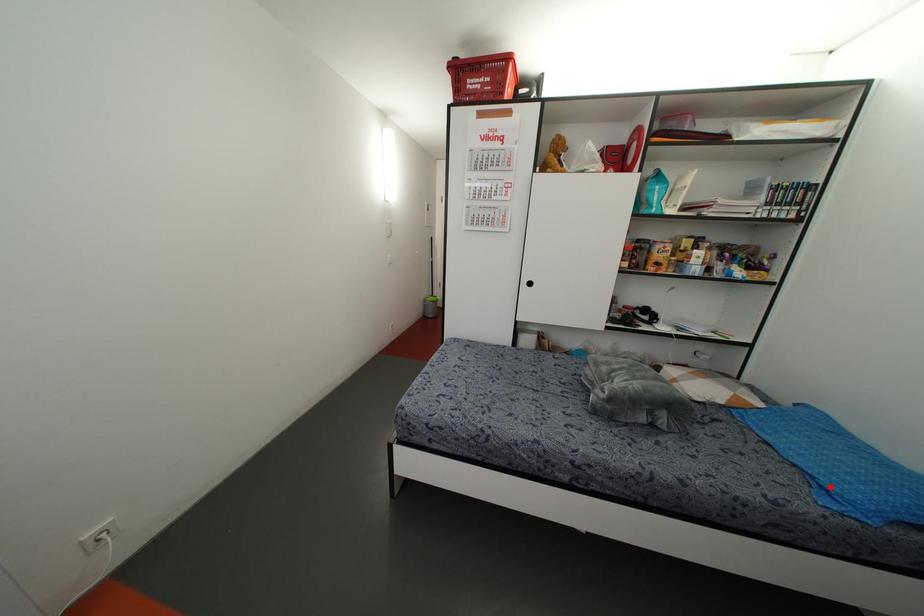
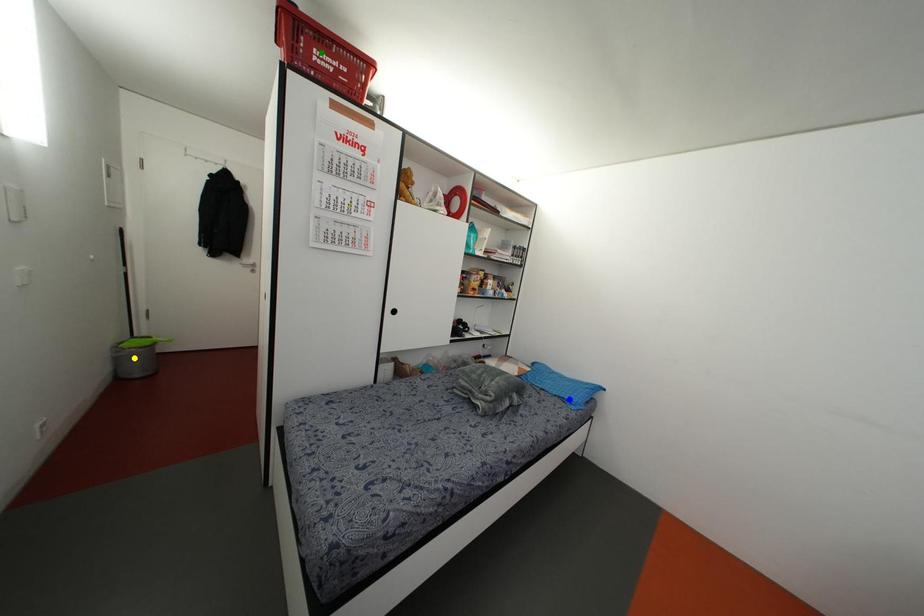
Question: I am providing you with two images of the same scene from different viewpoints. A red point is marked on the first image. You are given multiple points on the second image. Which spot in image 2 lines up with the point in image 1?

Choices:
 (A) green point
 (B) yellow point
 (C) blue point

Answer: (C)